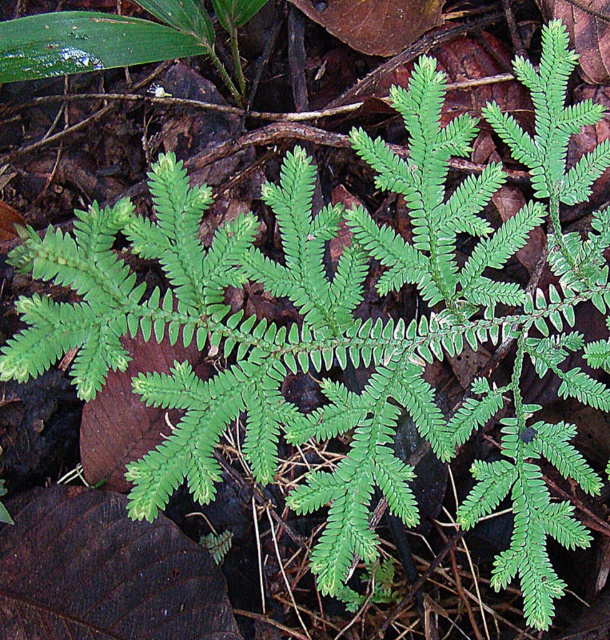
You are a botanist measuring distances between leaves in the forest. You have a ruler that can extend up to 25 inches. Can you measure the distance between the dark brown textured leaf at lower left and the green matte leaf at upper left with your ruler?

The dark brown textured leaf at lower left is 26.28 inches from the green matte leaf at upper left, so the ruler cannot reach the full distance. You will need a longer measuring tool.

You are a botanist examining the plant and its surroundings. You notice the dark brown textured leaf at lower left and the green matte leaf at upper left. Which leaf is positioned closer to you?

The dark brown textured leaf at lower left is closer to the viewer than the green matte leaf at upper left.

You are a botanist examining the plant and its surroundings. You notice the dark brown textured leaf at lower left and the green matte leaf at upper left. Which one has a greater height?

The dark brown textured leaf at lower left is much taller than the green matte leaf at upper left, so it has a greater height.